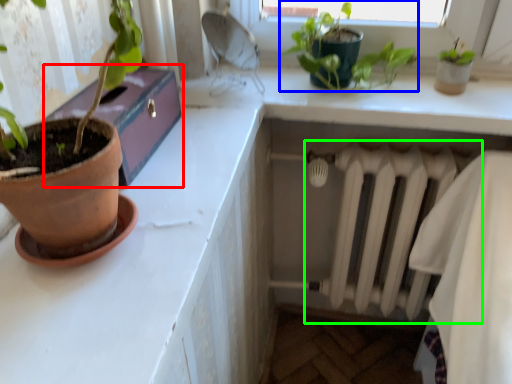
Question: Which object is positioned closest to window box (highlighted by a red box)? Select from houseplant (highlighted by a blue box) and radiator (highlighted by a green box).

Choices:
 (A) houseplant
 (B) radiator

Answer: (A)